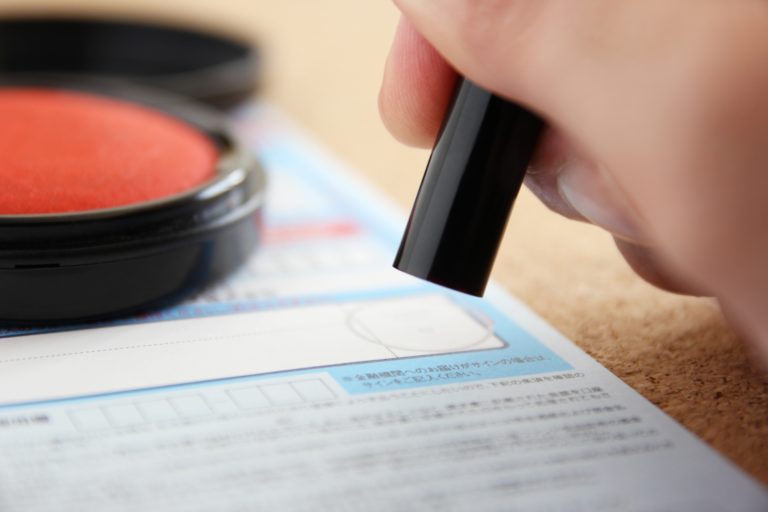
In order to click on carpet brown light in this screenshot , I will do 584,287.